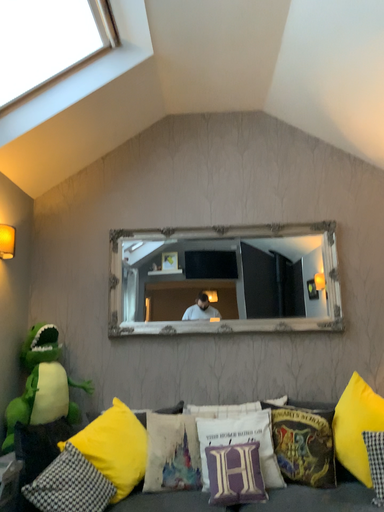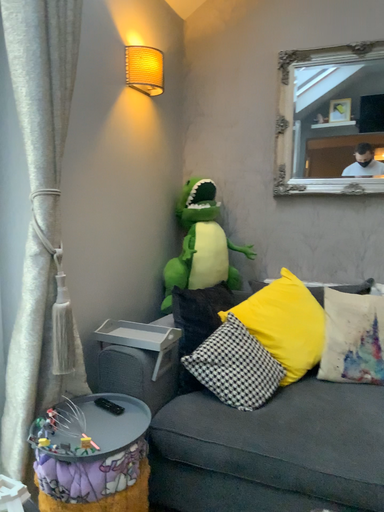
Question: Which way did the camera rotate in the video?

Choices:
 (A) rotated left
 (B) rotated right

Answer: (A)